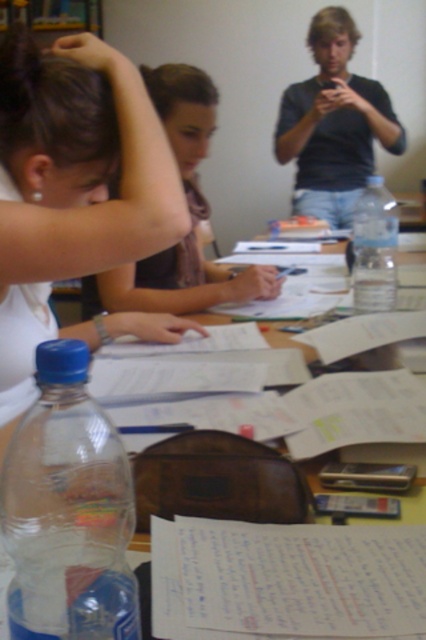
From the picture: You are a person sitting at the table and want to reach the clear plastic bottle at center. The person wearing the matte black shirt at upper center is blocking your path. Can you safely reach the bottle without moving the person?

The distance between the clear plastic bottle at center and the matte black shirt at upper center is 2.73 meters. Since the person is blocking your path and the distance is quite large, it would not be safe to reach for the bottle without moving the person.

You are a participant in the study session and need to place a new document on the table. The table has limited space. Where should you place it to avoid covering the white paper at center?

The white paper at center is located at point (285,579), so you should place the new document in an area of the table that does not overlap with this coordinate to avoid covering it.

You are standing at the origin point in the image. Which of the two points, point (345, 64) or point (394, 200), is closer to you?

Point (345, 64) is in front of point (394, 200), so it is closer to you.